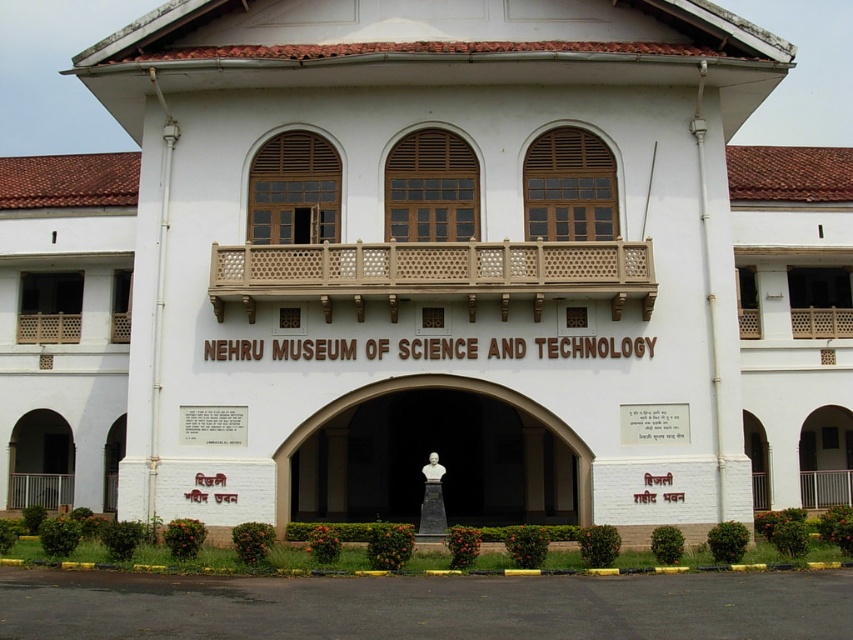
Question: Can you confirm if white marble bust at center is smaller than black marble bust at center?

Choices:
 (A) no
 (B) yes

Answer: (A)

Question: Which point appears farthest from the camera in this image?

Choices:
 (A) (425, 481)
 (B) (297, 426)

Answer: (A)

Question: Is white marble bust at center further to the viewer compared to black marble bust at center?

Choices:
 (A) yes
 (B) no

Answer: (B)

Question: Which of the following is the farthest from the observer?

Choices:
 (A) black marble bust at center
 (B) white marble bust at center

Answer: (A)

Question: Among these objects, which one is farthest from the camera?

Choices:
 (A) white marble bust at center
 (B) black marble bust at center

Answer: (B)

Question: Is white marble bust at center above black marble bust at center?

Choices:
 (A) yes
 (B) no

Answer: (A)